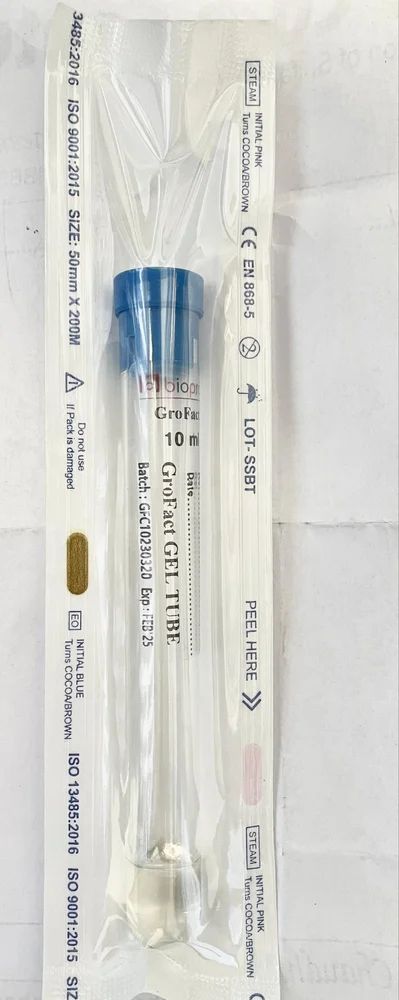
Find the location of a particular element. This screenshot has width=399, height=1000. box is located at coordinates (251, 847), (253, 73).